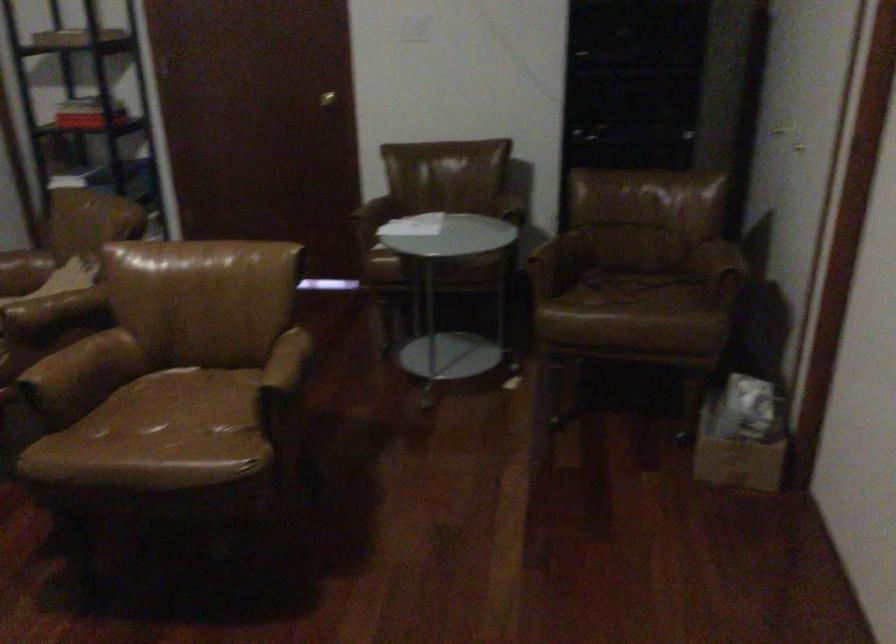
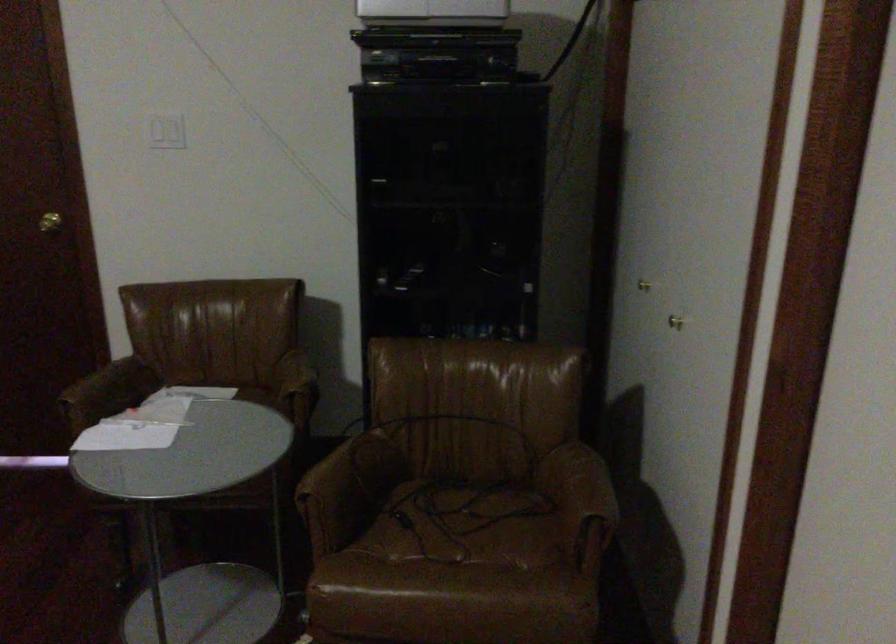
Where in the second image is the point corresponding to point (719, 257) from the first image?

(582, 485)